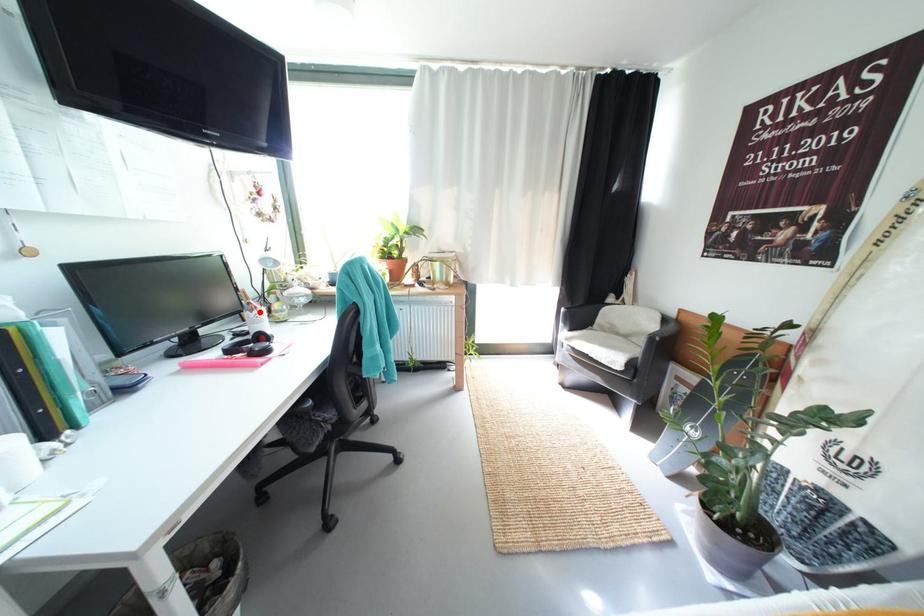
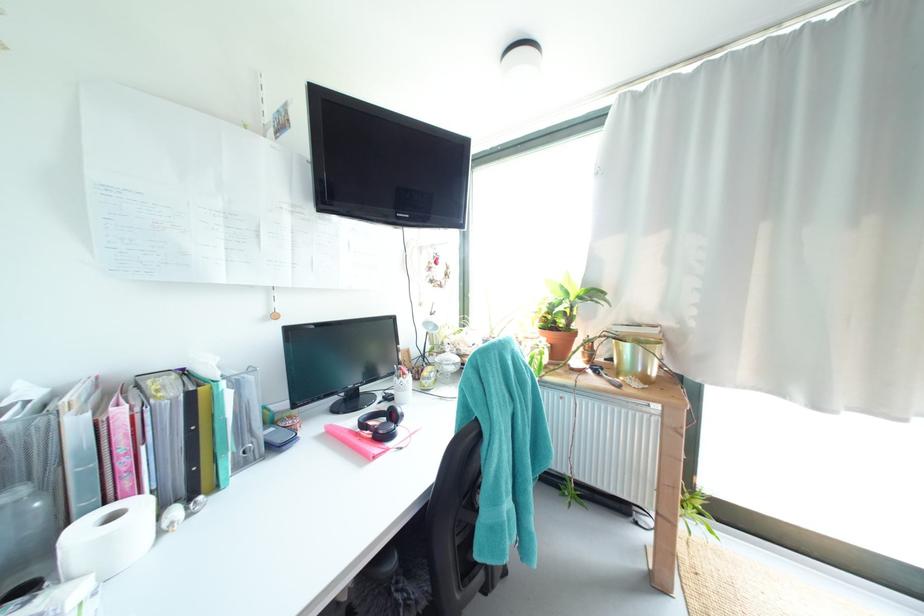
Question: I am providing you with two images of the same scene from different viewpoints. A red point is marked on the first image. Can you still see the location of the red point in image 2?

Choices:
 (A) Yes
 (B) No

Answer: (A)